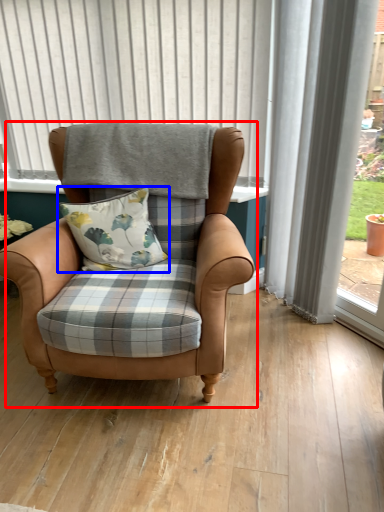
Question: Which point is closer to the camera, chair (highlighted by a red box) or pillow (highlighted by a blue box)?

Choices:
 (A) chair
 (B) pillow

Answer: (A)